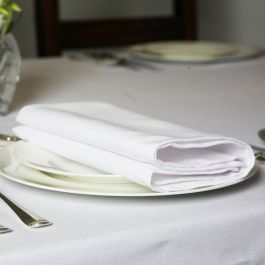
I want to click on white painted wall, so click(x=236, y=13), click(x=24, y=26), click(x=111, y=6).